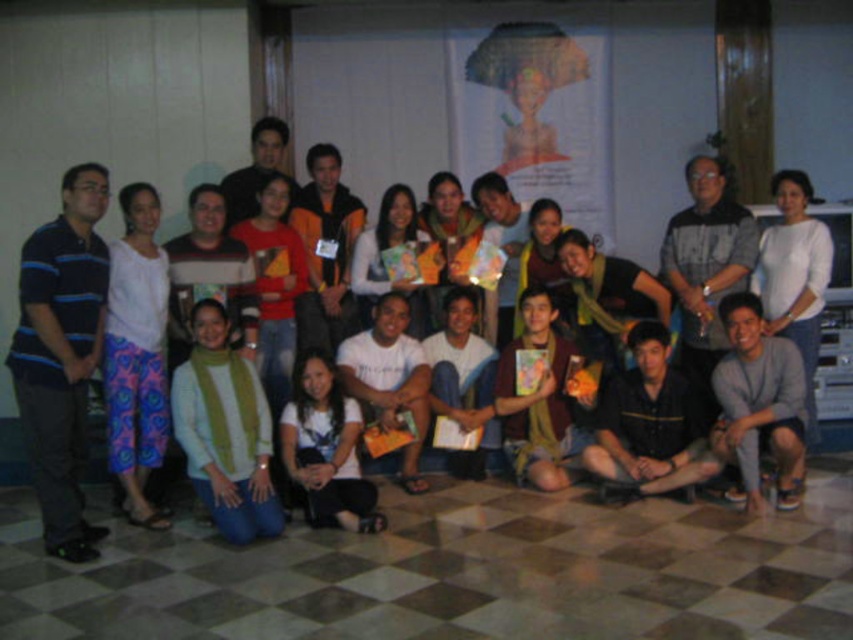
Question: Where is white matte shirt at upper right located in relation to orange fleece jacket at center in the image?

Choices:
 (A) below
 (B) above

Answer: (A)

Question: From the image, what is the correct spatial relationship of black textured shirt at center in relation to white matte shirt at lower center?

Choices:
 (A) left
 (B) right

Answer: (B)

Question: Among these objects, which one is farthest from the camera?

Choices:
 (A) black textured shirt at center
 (B) green knitted sweater at lower left
 (C) blue printed pants at left
 (D) orange fleece jacket at center

Answer: (D)

Question: Which object is closer to the camera taking this photo?

Choices:
 (A) blue printed pants at left
 (B) green knitted sweater at lower left

Answer: (B)

Question: Can you confirm if blue printed pants at left is bigger than white matte shirt at upper right?

Choices:
 (A) no
 (B) yes

Answer: (A)

Question: Which point is closer to the camera taking this photo?

Choices:
 (A) (114, 404)
 (B) (790, 188)

Answer: (A)